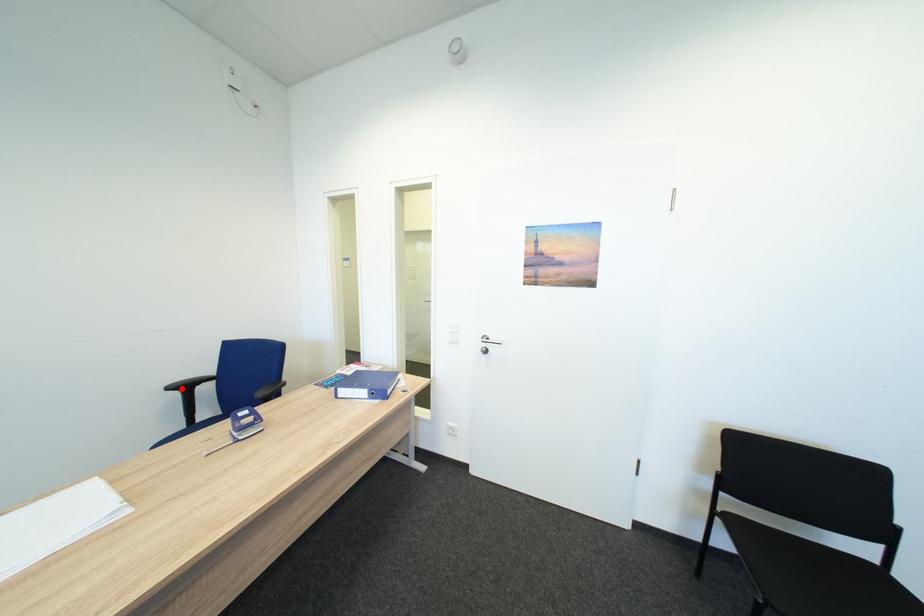
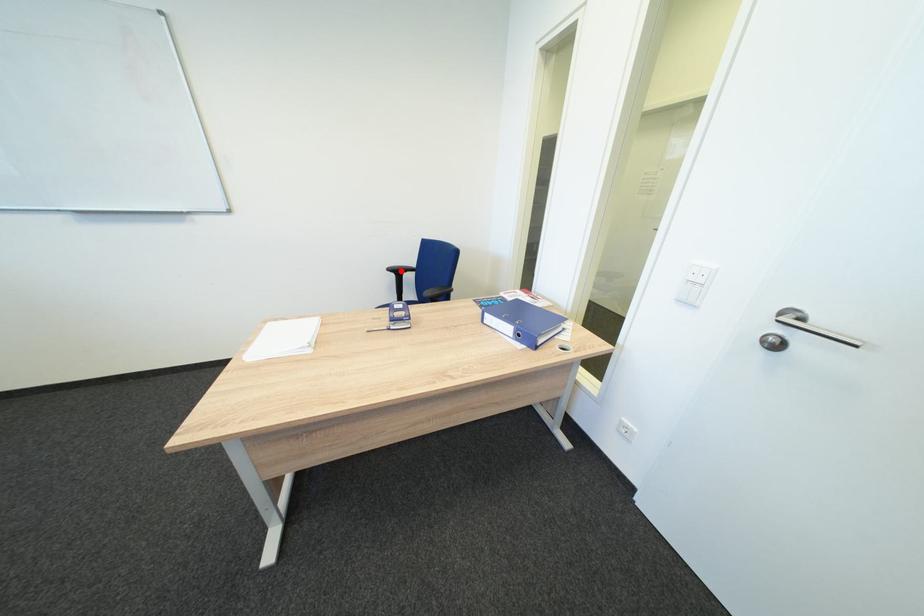
I am providing you with two images of the same scene from different viewpoints. A red point is marked on the first image and another point is marked on the second image. Is the red point in image1 aligned with the point shown in image2?

Yes